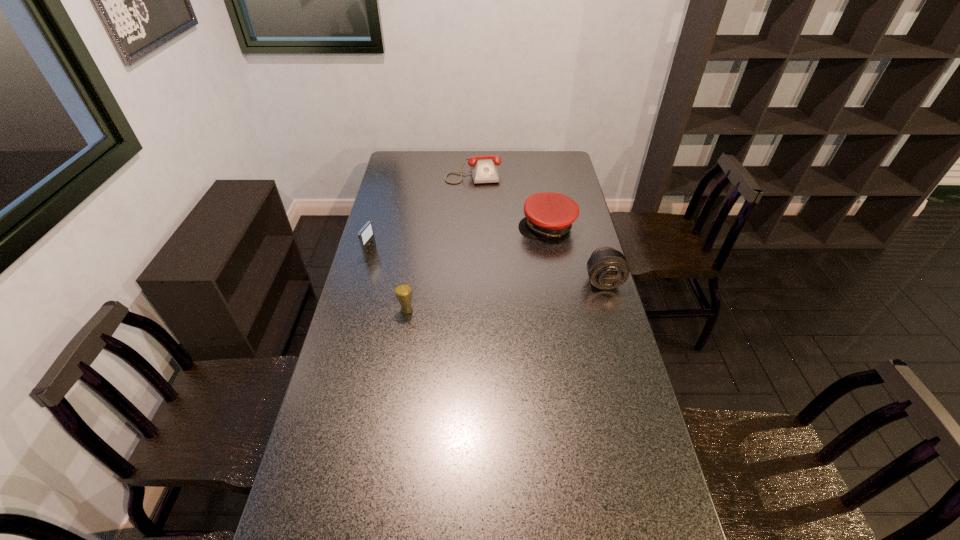
At what (x,y) coordinates should I click in order to perform the action: click on the fourth closest object to the fourth nearest object. Please return your answer as a coordinate pair (x, y). This screenshot has height=540, width=960. Looking at the image, I should click on (366, 235).

Identify which object is located as the fourth nearest to the leftmost object. Please provide its 2D coordinates. Your answer should be formatted as a tuple, i.e. [(x, y)], where the tuple contains the x and y coordinates of a point satisfying the conditions above.

[(607, 268)]

Identify the location of vacant space that satisfies the following two spatial constraints: 1. on the back side of the cap; 2. on the right side of the fourth object from right to left. This screenshot has width=960, height=540. (420, 227).